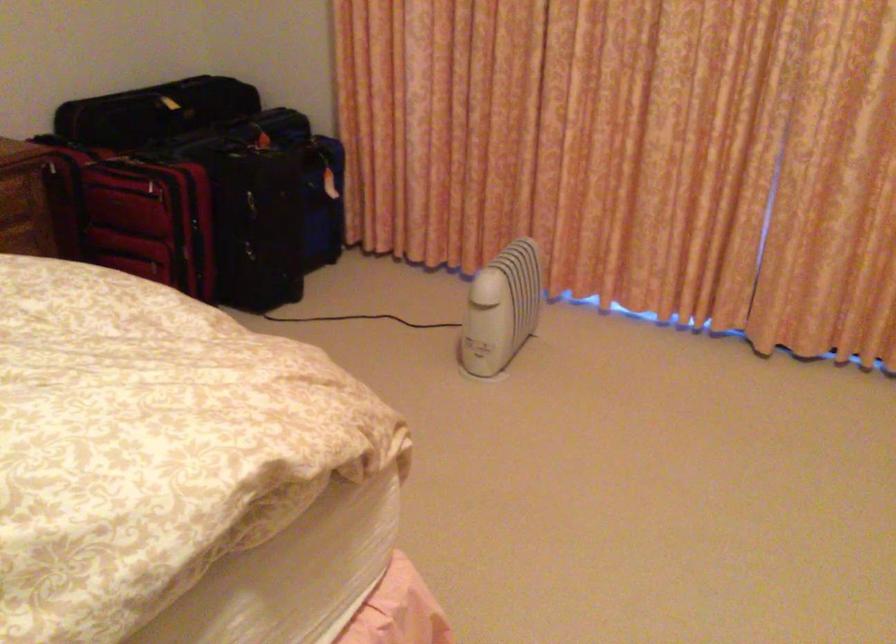
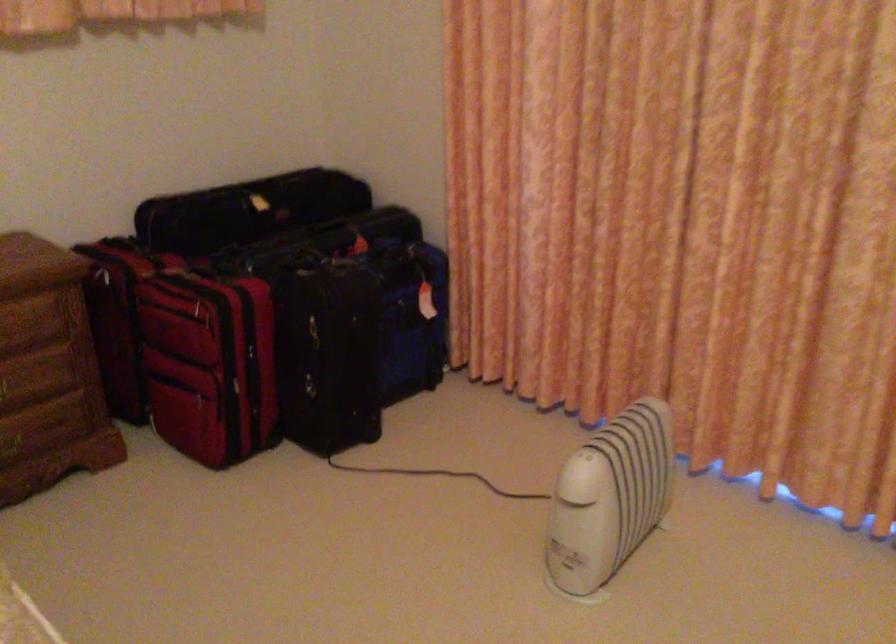
The point at (507, 306) is marked in the first image. Where is the corresponding point in the second image?

(609, 498)